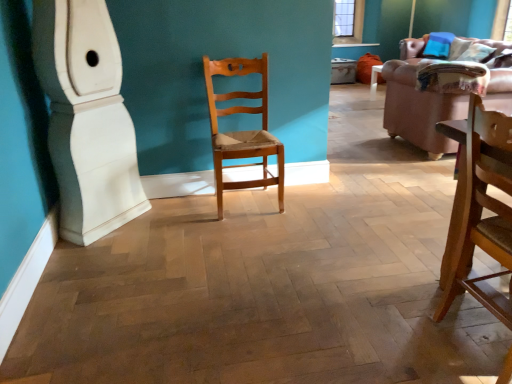
Question: Can you confirm if brown leather couch at upper right is smaller than light brown wood chair at center, which ranks as the 1th chair in left-to-right order?

Choices:
 (A) yes
 (B) no

Answer: (B)

Question: Would you say brown leather couch at upper right contains light brown wood chair at center, which ranks as the 1th chair in left-to-right order?

Choices:
 (A) no
 (B) yes

Answer: (A)

Question: Is brown leather couch at upper right oriented towards light brown wood chair at center, the second chair viewed from the right?

Choices:
 (A) no
 (B) yes

Answer: (B)

Question: Is brown leather couch at upper right with light brown wood chair at center, the 1th chair from the back?

Choices:
 (A) no
 (B) yes

Answer: (A)

Question: From the image's perspective, would you say brown leather couch at upper right is shown under light brown wood chair at center, the 1th chair from the back?

Choices:
 (A) yes
 (B) no

Answer: (B)

Question: Is point (477, 39) positioned closer to the camera than point (508, 223)?

Choices:
 (A) farther
 (B) closer

Answer: (A)

Question: Is brown leather couch at upper right inside the boundaries of wooden chair at right, positioned as the 1th chair in front-to-back order, or outside?

Choices:
 (A) inside
 (B) outside

Answer: (B)

Question: Is brown leather couch at upper right bigger or smaller than wooden chair at right, which is the 2th chair in back-to-front order?

Choices:
 (A) small
 (B) big

Answer: (B)

Question: In the image, is brown leather couch at upper right on the left side or the right side of wooden chair at right, which is the 2th chair in back-to-front order?

Choices:
 (A) left
 (B) right

Answer: (B)

Question: In terms of size, does velvet pink couch at right appear bigger or smaller than wooden chair at right, the 1th chair viewed from the right?

Choices:
 (A) big
 (B) small

Answer: (A)

Question: In the image, is velvet pink couch at right positioned in front of or behind wooden chair at right, marked as the second chair in a left-to-right arrangement?

Choices:
 (A) front
 (B) behind

Answer: (B)

Question: Is point (499, 102) closer or farther from the camera than point (475, 167)?

Choices:
 (A) closer
 (B) farther

Answer: (A)

Question: Visually, is velvet pink couch at right positioned to the left or to the right of wooden chair at right, marked as the second chair in a left-to-right arrangement?

Choices:
 (A) right
 (B) left

Answer: (A)

Question: Considering the positions of point (464, 36) and point (390, 89), is point (464, 36) closer or farther from the camera than point (390, 89)?

Choices:
 (A) closer
 (B) farther

Answer: (B)

Question: Considering the positions of brown leather couch at upper right and velvet pink couch at right in the image, is brown leather couch at upper right wider or thinner than velvet pink couch at right?

Choices:
 (A) wide
 (B) thin

Answer: (B)